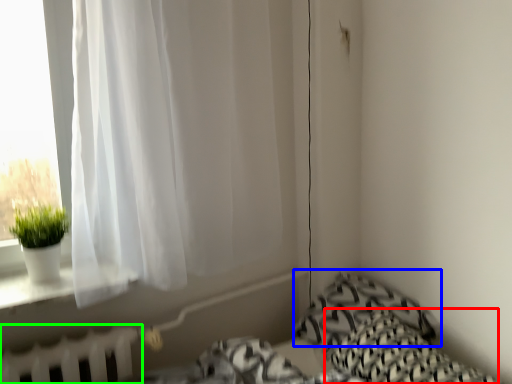
Question: Considering the real-world distances, which object is closest to pillow (highlighted by a red box)? pillow (highlighted by a blue box) or radiator (highlighted by a green box).

Choices:
 (A) pillow
 (B) radiator

Answer: (A)